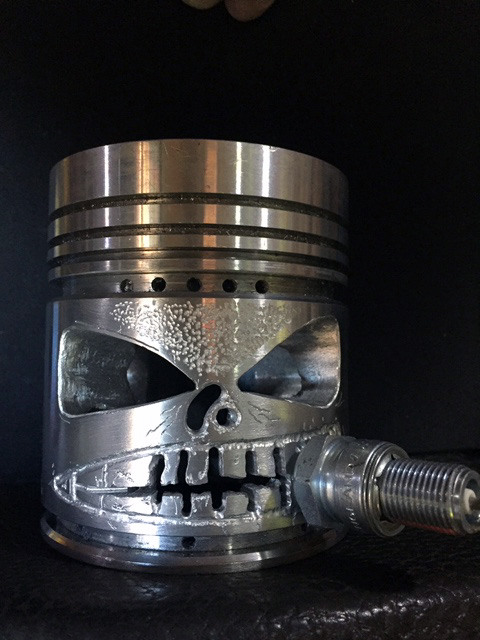
Image resolution: width=480 pixels, height=640 pixels. What are the coordinates of `surface` in the screenshot? It's located at (291, 588).